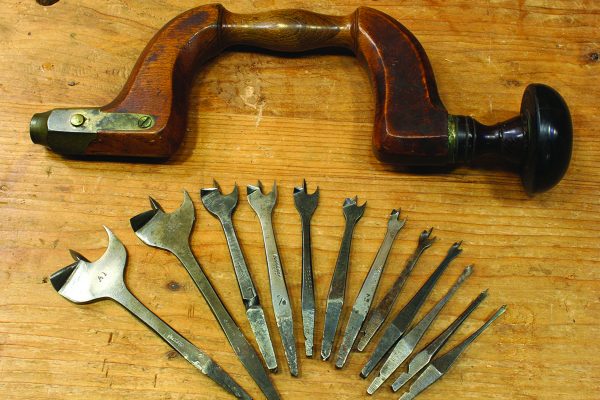
At what (x,y) coordinates should I click in order to perform the action: click on knob. Please return your answer as a coordinate pair (x, y). Image resolution: width=600 pixels, height=400 pixels. Looking at the image, I should click on (506, 155).